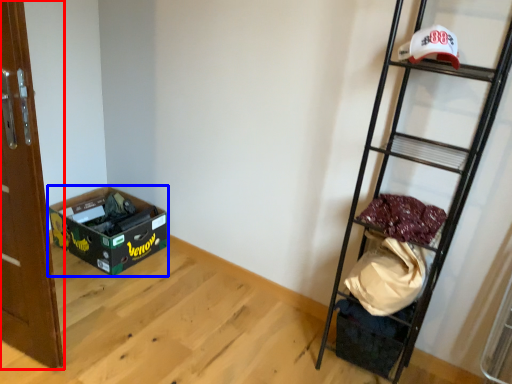
Question: Among these objects, which one is farthest to the camera, door (highlighted by a red box) or box (highlighted by a blue box)?

Choices:
 (A) door
 (B) box

Answer: (B)